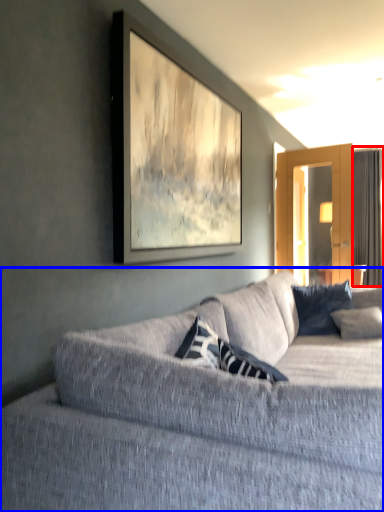
Question: Which point is further to the camera, curtain (highlighted by a red box) or studio couch (highlighted by a blue box)?

Choices:
 (A) curtain
 (B) studio couch

Answer: (A)